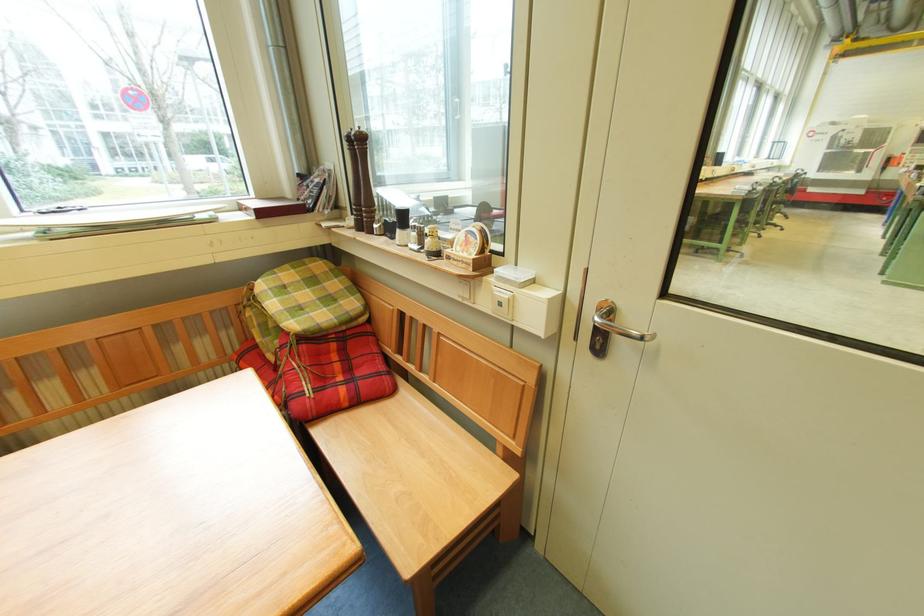
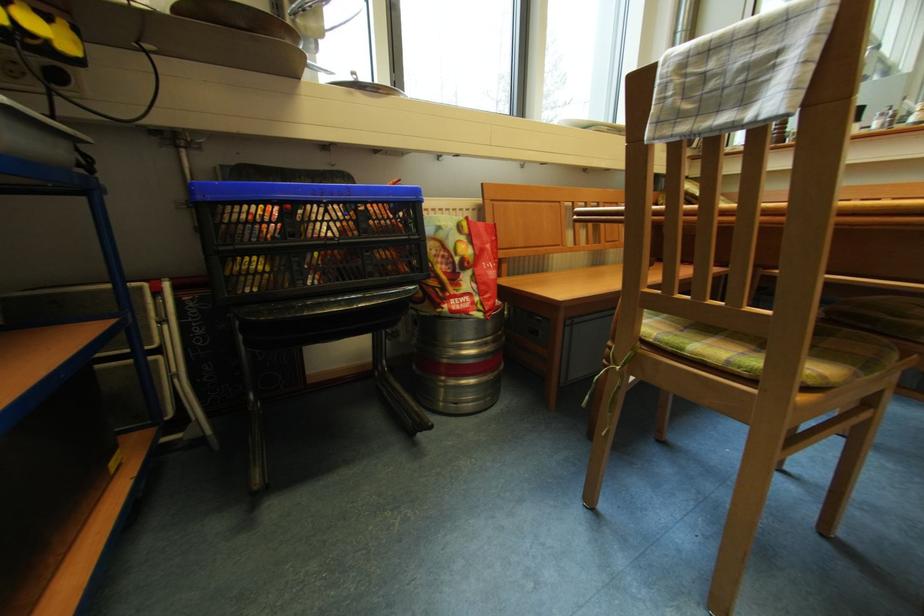
Question: Which direction would the cameraman need to move to produce the second image? Reply with the corresponding letter.

Choices:
 (A) Left
 (B) Right
 (C) Forward
 (D) Backward

Answer: (A)